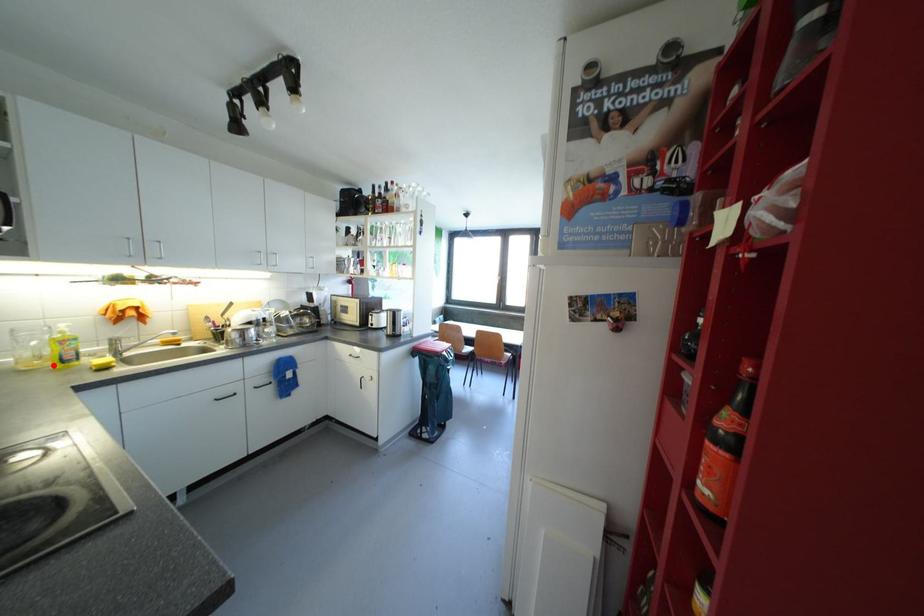
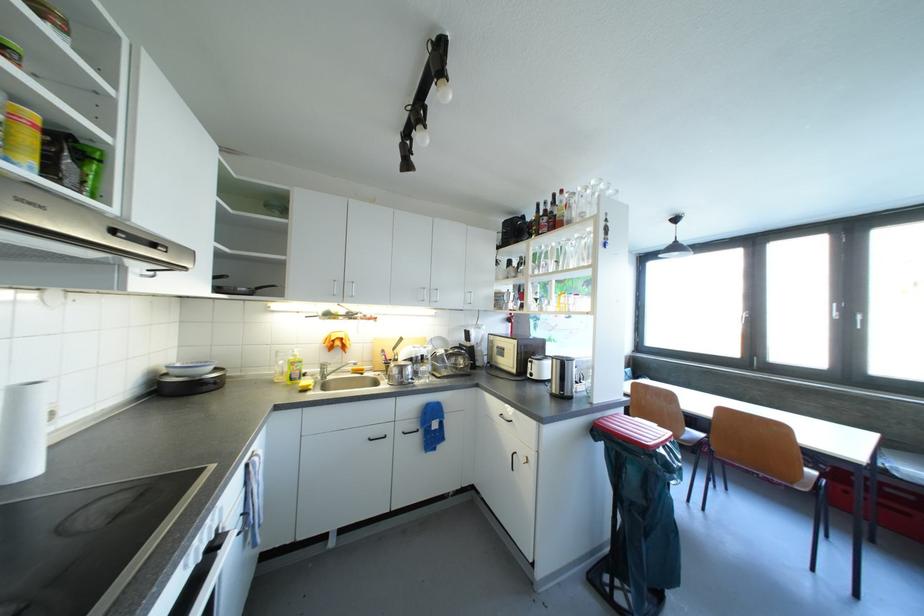
Find the pixel in the second image that matches the highlighted location in the first image.

(290, 382)